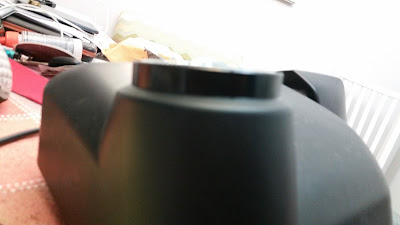
You are a GUI agent. You are given a task and a screenshot of the screen. Output one action in this format:
    pyautogui.click(x=<x>, y=<y>)
    Task: Click on the bottle
    
    Given the screenshot: What is the action you would take?
    pyautogui.click(x=46, y=40)